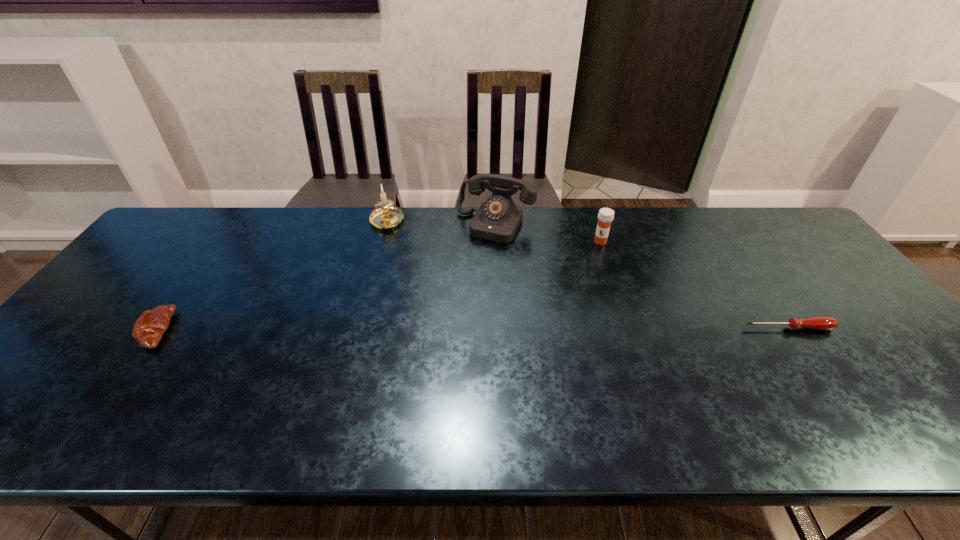
Find the location of a particular element. The width and height of the screenshot is (960, 540). free area in between the shortest object and the second object from left to right is located at coordinates (588, 275).

Where is `vacant region between the crescent roll and the third shortest object`? This screenshot has width=960, height=540. vacant region between the crescent roll and the third shortest object is located at coordinates (379, 286).

At what (x,y) coordinates should I click in order to perform the action: click on vacant area that lies between the screwdriver and the third object from right to left. Please return your answer as a coordinate pair (x, y). Looking at the image, I should click on (642, 276).

The height and width of the screenshot is (540, 960). I want to click on vacant space in between the telephone and the third tallest object, so click(x=548, y=233).

The image size is (960, 540). I want to click on unoccupied position between the leftmost object and the candle holder, so click(272, 276).

Where is `empty space between the rightmost object and the telephone`? The image size is (960, 540). empty space between the rightmost object and the telephone is located at coordinates (642, 276).

Select which object is the third closest to the fourth object from right to left. Please provide its 2D coordinates. Your answer should be formatted as a tuple, i.e. [(x, y)], where the tuple contains the x and y coordinates of a point satisfying the conditions above.

[(606, 215)]

Identify the location of object that is the closest one to the rightmost object. (606, 215).

This screenshot has height=540, width=960. What are the coordinates of `vacant space that satisfies the following two spatial constraints: 1. on the front side of the telephone; 2. on the right side of the third tallest object` in the screenshot? It's located at (496, 241).

Find the location of `free location that satisfies the following two spatial constraints: 1. on the front side of the third tallest object; 2. on the right side of the fourth object from right to left`. free location that satisfies the following two spatial constraints: 1. on the front side of the third tallest object; 2. on the right side of the fourth object from right to left is located at coordinates (381, 241).